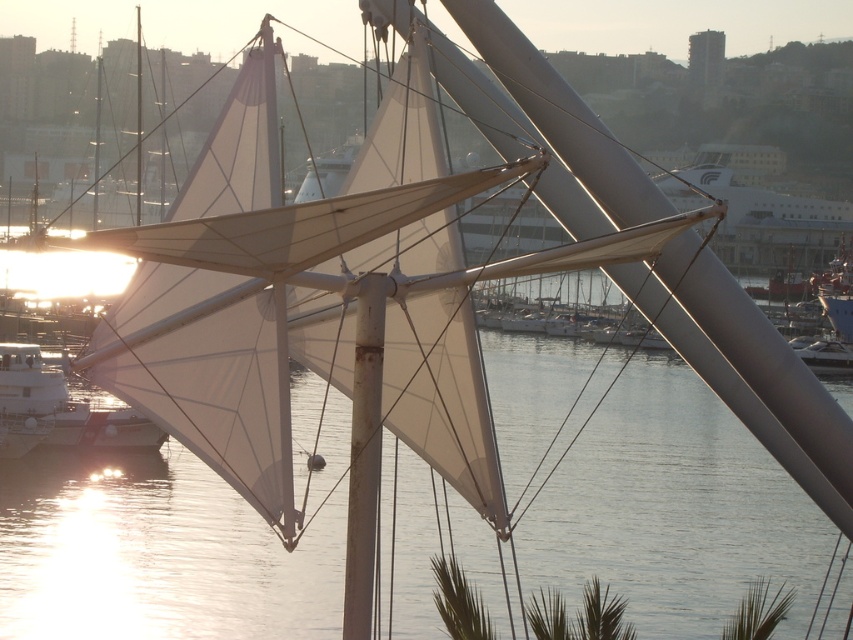
Question: Which object appears closest to the camera in this image?

Choices:
 (A) transparent water at center
 (B) white matte sailboat at lower left

Answer: (A)

Question: Which of the following is the closest to the observer?

Choices:
 (A) white matte sailboat at lower left
 (B) transparent water at center

Answer: (B)

Question: Is transparent water at center positioned in front of white matte sailboat at lower left?

Choices:
 (A) yes
 (B) no

Answer: (A)

Question: Among these points, which one is farthest from the camera?

Choices:
 (A) (780, 484)
 (B) (24, 349)

Answer: (A)

Question: Does transparent water at center appear over white matte sailboat at lower left?

Choices:
 (A) no
 (B) yes

Answer: (A)

Question: Is transparent water at center smaller than white matte sailboat at lower left?

Choices:
 (A) yes
 (B) no

Answer: (B)